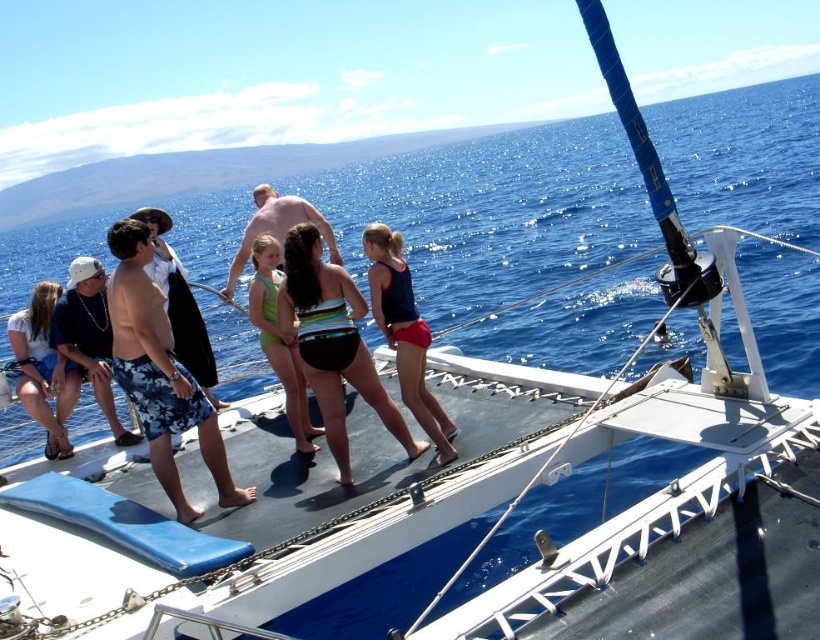
You are a lifeguard on the catamaran deck. You need to quickly assess the space taken up by the matte black shorts at left and the camouflage shorts at center. Which pair of shorts takes up more space?

The camouflage shorts at center takes up more space than the matte black shorts at left because the matte black shorts at left occupies less space than camouflage shorts at center.

You are a photographer on the catamaran deck. You need to take a photo of both the camouflage shorts at left and green swimsuit at center. Can you see both items clearly in the same frame?

The camouflage shorts at left is positioned under the green swimsuit at center, so it might be partially or fully obscured, making it difficult to see both clearly in the same frame.

You are a photographer on the deck of the catamaran. You need to capture a photo of both the camouflage shorts at left and the green swimsuit at center. Which object should you focus on first if you want to ensure both are in the frame without moving the camera?

You should focus on the camouflage shorts at left first because it is larger in size than the green swimsuit at center, so centering it first will help frame both objects appropriately.